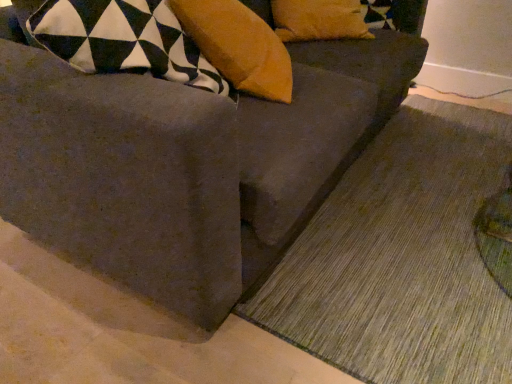
Find the location of a particular element. This screenshot has height=384, width=512. green textured mat at lower right is located at coordinates (402, 257).

Image resolution: width=512 pixels, height=384 pixels. What do you see at coordinates (402, 257) in the screenshot? I see `green textured mat at lower right` at bounding box center [402, 257].

Measure the distance between green textured mat at lower right and camera.

A distance of 1.10 meters exists between green textured mat at lower right and camera.

Find the location of `green textured mat at lower right`. green textured mat at lower right is located at coordinates (402, 257).